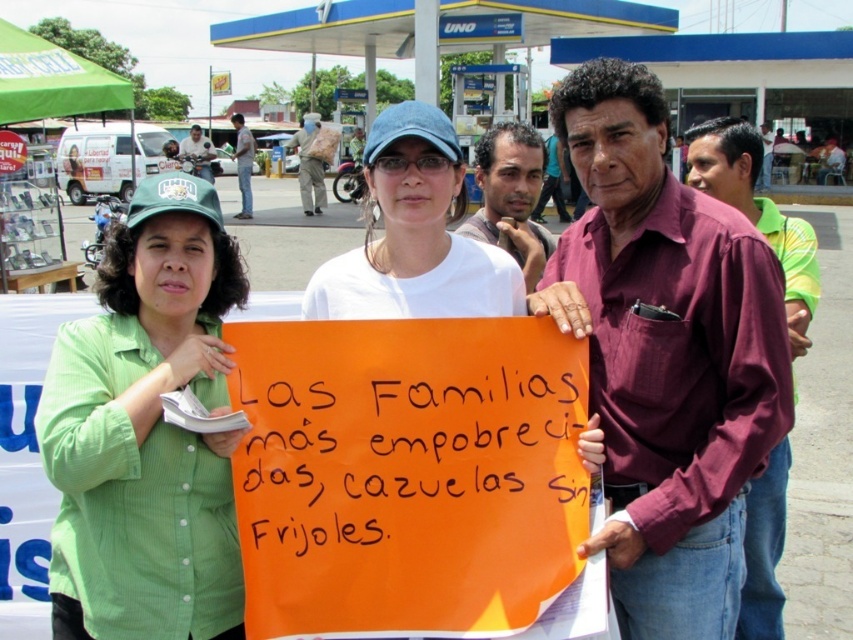
Question: Is green button-down shirt at center to the right of smooth brown shirt at center from the viewer's perspective?

Choices:
 (A) yes
 (B) no

Answer: (B)

Question: Which is nearer to the dark blue jeans at upper center?

Choices:
 (A) maroon shirt at right
 (B) maroon cotton shirt at center

Answer: (A)

Question: Does maroon cotton shirt at center lie behind dark brown hair at center?

Choices:
 (A) no
 (B) yes

Answer: (A)

Question: Which object is farther from the camera taking this photo?

Choices:
 (A) smooth brown shirt at center
 (B) maroon cotton shirt at center

Answer: (A)

Question: Which object is the closest to the maroon shirt at right?

Choices:
 (A) matte black helmet at upper left
 (B) smooth brown shirt at center

Answer: (B)

Question: In this image, where is green button-down shirt at center located relative to maroon shirt at right?

Choices:
 (A) below
 (B) above

Answer: (A)